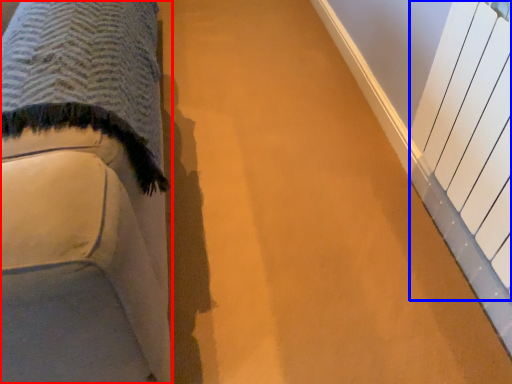
Question: Which object is closer to the camera taking this photo, furniture (highlighted by a red box) or radiator (highlighted by a blue box)?

Choices:
 (A) furniture
 (B) radiator

Answer: (A)